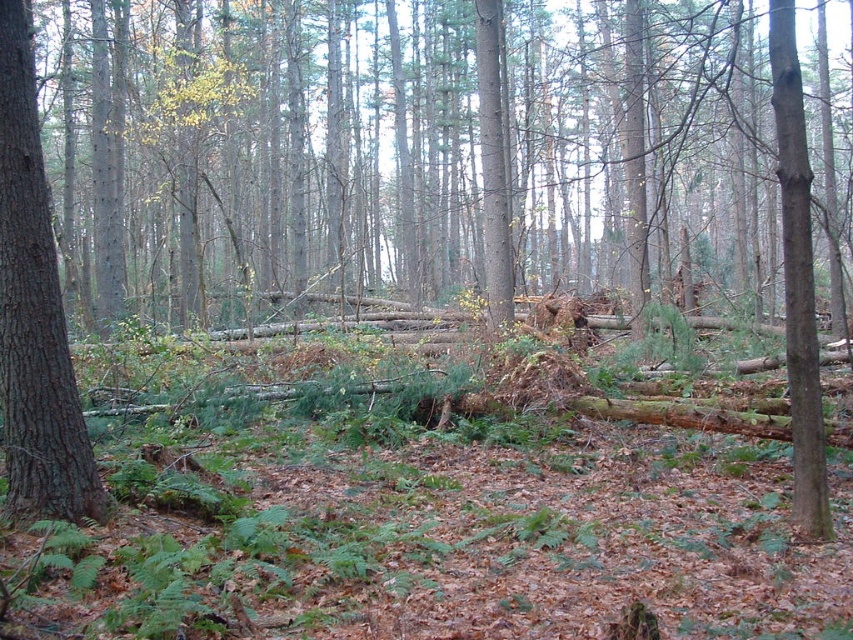
Question: Which of the following is the closest to the observer?

Choices:
 (A) brown rough tree trunk at right
 (B) smooth brown tree trunk at left

Answer: (B)

Question: Among these points, which one is farthest from the camera?

Choices:
 (A) (35, 435)
 (B) (809, 259)

Answer: (B)

Question: Is smooth brown tree trunk at left to the right of brown rough tree trunk at right from the viewer's perspective?

Choices:
 (A) yes
 (B) no

Answer: (B)

Question: Which of the following is the farthest from the observer?

Choices:
 (A) (38, 224)
 (B) (821, 454)

Answer: (B)

Question: Does smooth brown tree trunk at left appear over brown rough tree trunk at right?

Choices:
 (A) no
 (B) yes

Answer: (B)

Question: Considering the relative positions of smooth brown tree trunk at left and brown rough tree trunk at right in the image provided, where is smooth brown tree trunk at left located with respect to brown rough tree trunk at right?

Choices:
 (A) below
 (B) above

Answer: (B)